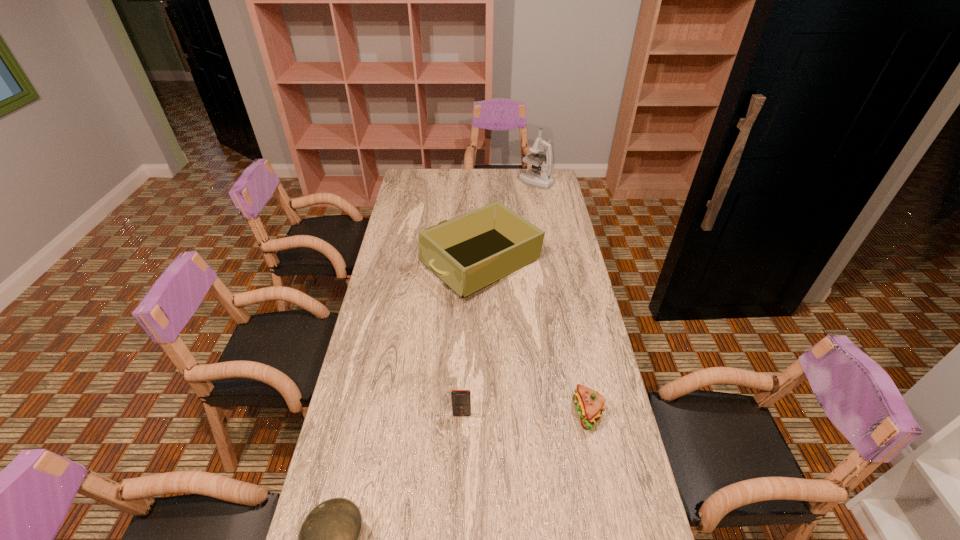
Locate an element on the screen. Image resolution: width=960 pixels, height=540 pixels. object that is at the far edge is located at coordinates (543, 179).

Identify the location of object that is at the left edge. This screenshot has width=960, height=540. (469, 252).

Locate an element on the screen. microscope positioned at the right edge is located at coordinates (543, 179).

You are a GUI agent. You are given a task and a screenshot of the screen. Output one action in this format:
    pyautogui.click(x=<x>, y=<y>)
    Task: Click on the box present at the right edge
    The height and width of the screenshot is (540, 960).
    Given the screenshot: What is the action you would take?
    pyautogui.click(x=469, y=252)

The height and width of the screenshot is (540, 960). Find the location of `sandwich at the right edge`. sandwich at the right edge is located at coordinates (589, 403).

This screenshot has height=540, width=960. Identify the location of object that is positioned at the far right corner. tap(543, 179).

Where is `vacant space at the far edge of the desktop`? Image resolution: width=960 pixels, height=540 pixels. vacant space at the far edge of the desktop is located at coordinates (443, 178).

In the image, there is a desktop. Find the location of `vacant space at the left edge`. vacant space at the left edge is located at coordinates (377, 451).

This screenshot has height=540, width=960. I want to click on free region at the right edge of the desktop, so click(530, 193).

You are a GUI agent. You are given a task and a screenshot of the screen. Output one action in this format:
    pyautogui.click(x=<x>, y=<y>)
    Task: Click on the blank region between the cellular telephone and the second farthest object
    
    Given the screenshot: What is the action you would take?
    pyautogui.click(x=471, y=339)